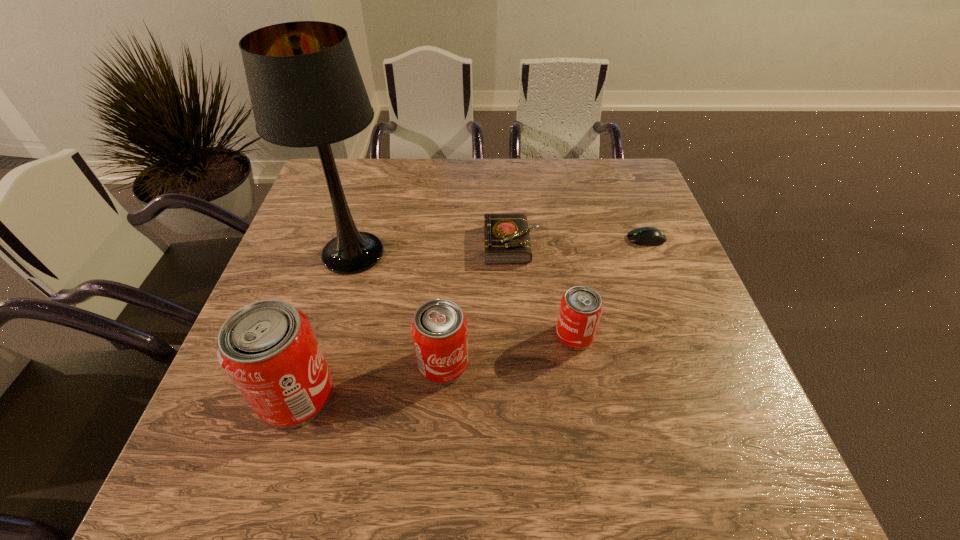
This screenshot has width=960, height=540. I want to click on vacant spot to place a can on the right, so click(693, 310).